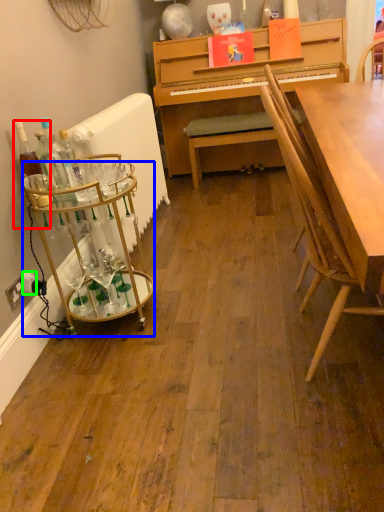
Question: Considering the real-world distances, which object is closest to bottle (highlighted by a red box)? desk (highlighted by a blue box) or power outlet (highlighted by a green box).

Choices:
 (A) desk
 (B) power outlet

Answer: (A)